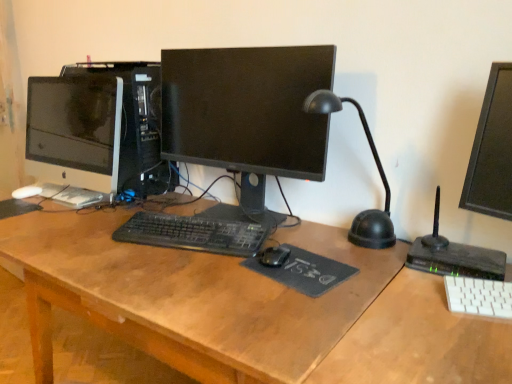
Find the location of `vacant region in front of white glossy monitor at left, acting as the second computer monitor starting from the right`. vacant region in front of white glossy monitor at left, acting as the second computer monitor starting from the right is located at coordinates (58, 226).